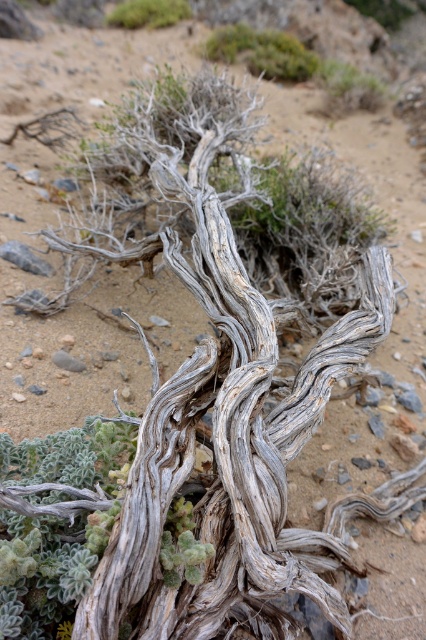
Question: Does gray textured root at center appear over green fuzzy plant at upper center?

Choices:
 (A) no
 (B) yes

Answer: (A)

Question: Which point is farther to the camera?

Choices:
 (A) (259, 61)
 (B) (46, 557)
 (C) (140, 13)

Answer: (C)

Question: Which point is closer to the camera taking this photo?

Choices:
 (A) (221, 45)
 (B) (65, 532)

Answer: (B)

Question: Which point is farther from the camera taking this photo?

Choices:
 (A) (69, 509)
 (B) (213, 52)
 (C) (106, 20)

Answer: (C)

Question: From the image, what is the correct spatial relationship of gray textured root at center in relation to green fuzzy plant at upper center?

Choices:
 (A) below
 (B) above

Answer: (A)

Question: Is gray textured root at center bigger than green fuzzy plant at upper center?

Choices:
 (A) no
 (B) yes

Answer: (A)